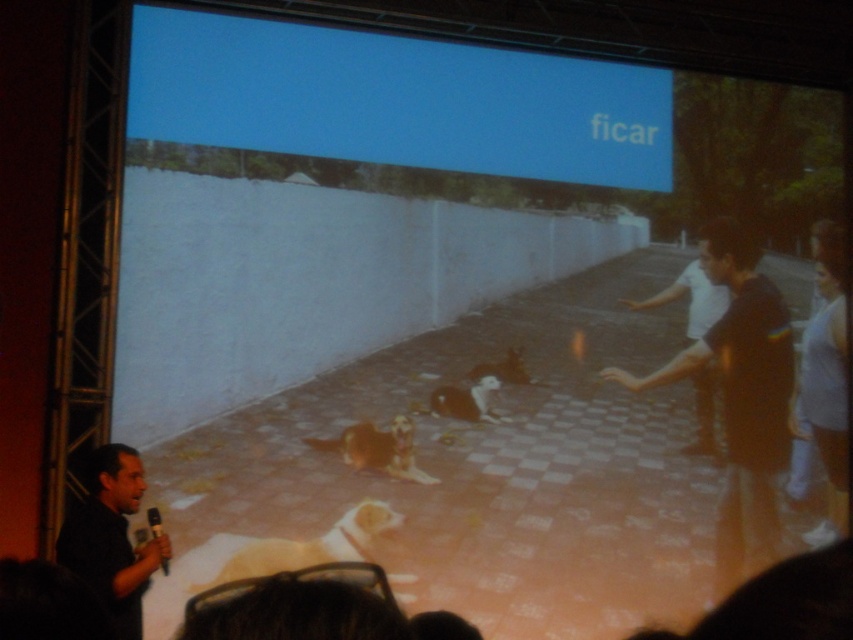
Which is more to the right, white matte wall at upper center or brown fur dog at center?

brown fur dog at center

Does white matte wall at upper center have a larger size compared to brown fur dog at center?

Correct, white matte wall at upper center is larger in size than brown fur dog at center.

Between point (436, 93) and point (515, 381), which one is positioned in front?

Point (515, 381) is in front.

Where is `white matte wall at upper center`? The height and width of the screenshot is (640, 853). white matte wall at upper center is located at coordinates point(350,196).

Does black matte shirt at lower left have a larger size compared to light brown fur dog at lower center?

Indeed, black matte shirt at lower left has a larger size compared to light brown fur dog at lower center.

Can you confirm if black matte shirt at lower left is wider than light brown fur dog at lower center?

No.

Who is more forward, (96, 456) or (219, 582)?

Positioned in front is point (96, 456).

Identify the location of black matte shirt at lower left. (111, 538).

Does white fur dog at center have a larger size compared to brown fur dog at center?

Yes.

Is white fur dog at center positioned before brown fur dog at center?

Yes, it is.

This screenshot has height=640, width=853. Describe the element at coordinates (465, 401) in the screenshot. I see `white fur dog at center` at that location.

Locate an element on the screen. white fur dog at center is located at coordinates (465, 401).